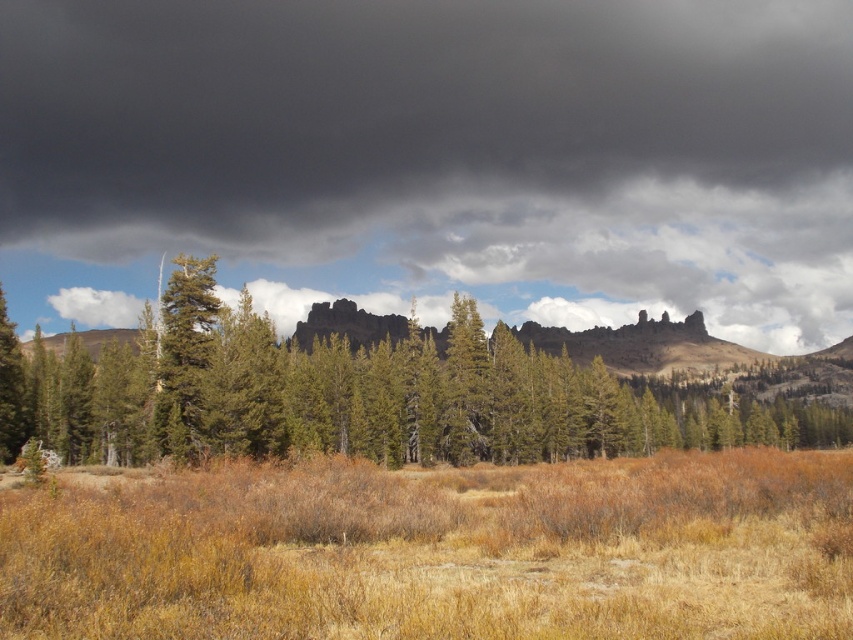
This screenshot has width=853, height=640. Describe the element at coordinates (434, 157) in the screenshot. I see `dark gray cloud at upper center` at that location.

Does point (393, 120) lie in front of point (335, 632)?

No, it is not.

Image resolution: width=853 pixels, height=640 pixels. Find the location of `dark gray cloud at upper center`. dark gray cloud at upper center is located at coordinates (434, 157).

Is brown dry grass at center further to the viewer compared to green matte tree at center?

No, it is in front of green matte tree at center.

Which is in front, point (268, 560) or point (256, 432)?

Point (268, 560) is in front.

Is point (152, 506) closer to camera compared to point (380, 456)?

That is True.

Find the location of a particular element. brown dry grass at center is located at coordinates (440, 552).

Between dark gray cloud at upper center and green matte tree at center, which one appears on the right side from the viewer's perspective?

green matte tree at center is more to the right.

Identify the location of dark gray cloud at upper center. (434, 157).

Who is more forward, (695, 83) or (827, 442)?

Point (827, 442) is more forward.

Where is `dark gray cloud at upper center`? Image resolution: width=853 pixels, height=640 pixels. dark gray cloud at upper center is located at coordinates (434, 157).